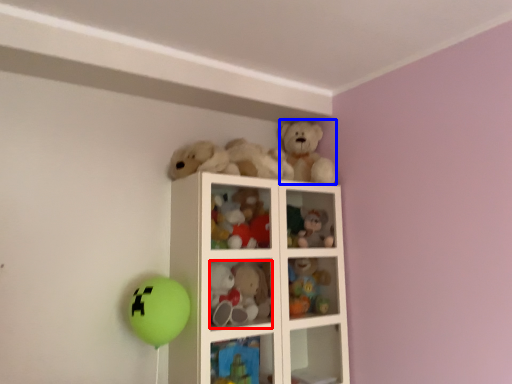
Question: Which object appears closest to the camera in this image, toy (highlighted by a red box) or toy (highlighted by a blue box)?

Choices:
 (A) toy
 (B) toy

Answer: (A)